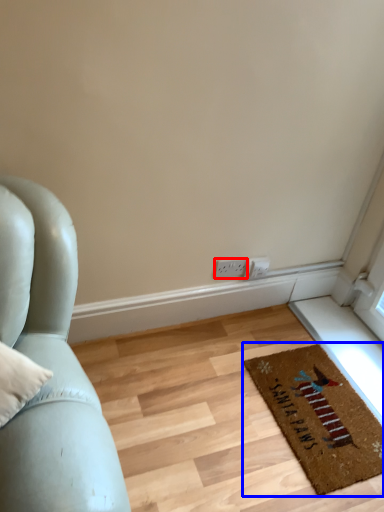
Question: Which object appears farthest to the camera in this image, electric outlet (highlighted by a red box) or mat (highlighted by a blue box)?

Choices:
 (A) electric outlet
 (B) mat

Answer: (A)